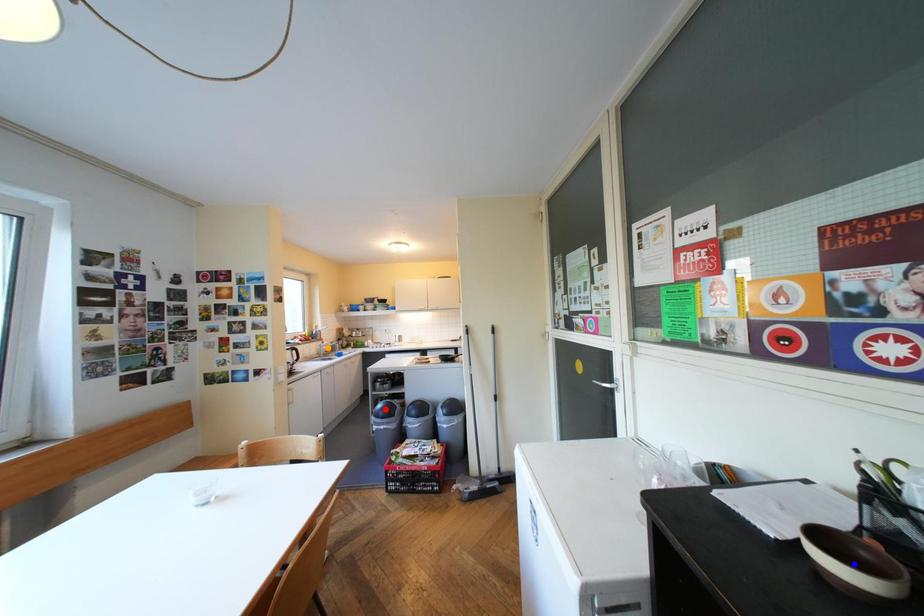
Based on the photo, order these from farthest to nearest:
blue point | orange point | red point

orange point < red point < blue point